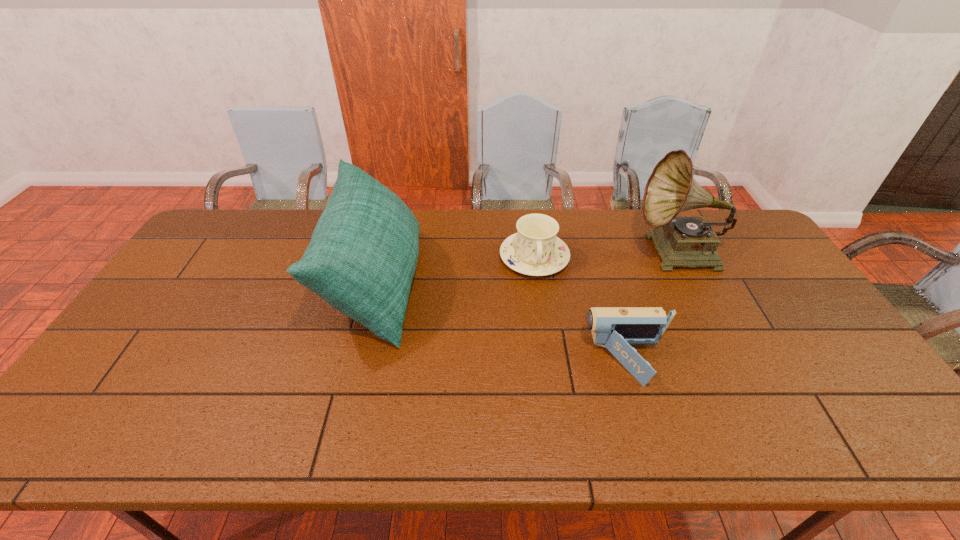
Where is `the rightmost object`? Image resolution: width=960 pixels, height=540 pixels. the rightmost object is located at coordinates (680, 241).

At what (x,y) coordinates should I click in order to perform the action: click on the tallest object. Please return your answer as a coordinate pair (x, y). Looking at the image, I should click on (680, 241).

The height and width of the screenshot is (540, 960). Find the location of `the second tallest object`. the second tallest object is located at coordinates (363, 253).

The width and height of the screenshot is (960, 540). What are the coordinates of `cushion` in the screenshot? It's located at (363, 253).

Locate an element on the screen. chinaware is located at coordinates (534, 250).

At what (x,y) coordinates should I click in order to perform the action: click on camcorder. Please return your answer as a coordinate pair (x, y). Image resolution: width=960 pixels, height=540 pixels. Looking at the image, I should click on (615, 328).

In order to click on blank area located from the horn of the rightmost object in this screenshot , I will do `click(540, 254)`.

This screenshot has height=540, width=960. In order to click on vacant space located from the horn of the rightmost object in this screenshot , I will do `click(534, 254)`.

You are a GUI agent. You are given a task and a screenshot of the screen. Output one action in this format:
    pyautogui.click(x=<x>, y=<y>)
    Task: Click on the free region located from the horn of the rightmost object
    This screenshot has height=540, width=960.
    Given the screenshot: What is the action you would take?
    pyautogui.click(x=516, y=254)

In order to click on vacant region located on the front-facing side of the cushion in this screenshot , I will do click(x=507, y=283).